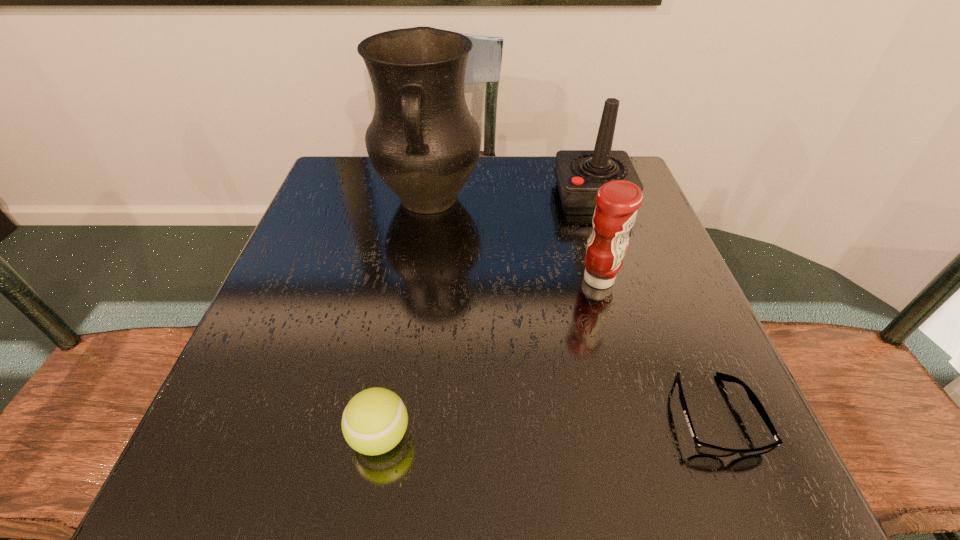
The width and height of the screenshot is (960, 540). In order to click on object identified as the third closest to the tallest object in this screenshot , I will do `click(375, 420)`.

Where is `the fourth closest object to the sunglasses`? the fourth closest object to the sunglasses is located at coordinates (423, 142).

Find the location of a particular element. The image size is (960, 540). blank area in the image that satisfies the following two spatial constraints: 1. on the front-facing side of the joystick; 2. on the handle side of the tallest object is located at coordinates (593, 200).

Identify the location of free spot that satisfies the following two spatial constraints: 1. on the back side of the fourth tallest object; 2. on the right side of the third nearest object. The width and height of the screenshot is (960, 540). (407, 279).

At what (x,y) coordinates should I click in order to perform the action: click on vacant region that satisfies the following two spatial constraints: 1. on the front-facing side of the joystick; 2. on the handle side of the pitcher. Please return your answer as a coordinate pair (x, y). Looking at the image, I should click on (593, 200).